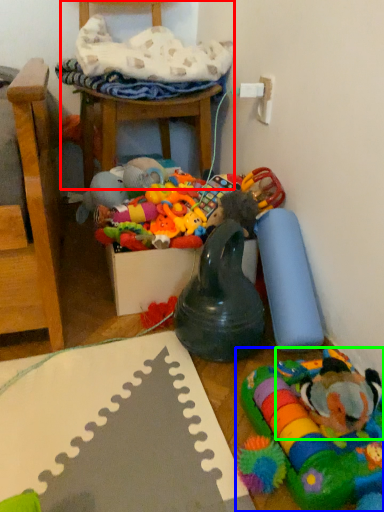
Question: Which is nearer to the chair (highlighted by a red box)? toy (highlighted by a blue box) or toy (highlighted by a green box).

Choices:
 (A) toy
 (B) toy

Answer: (A)